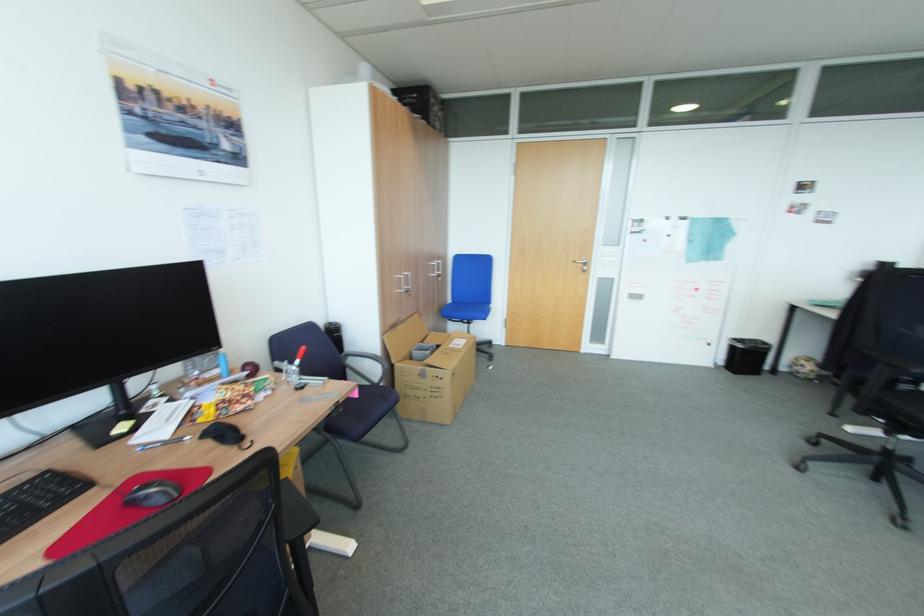
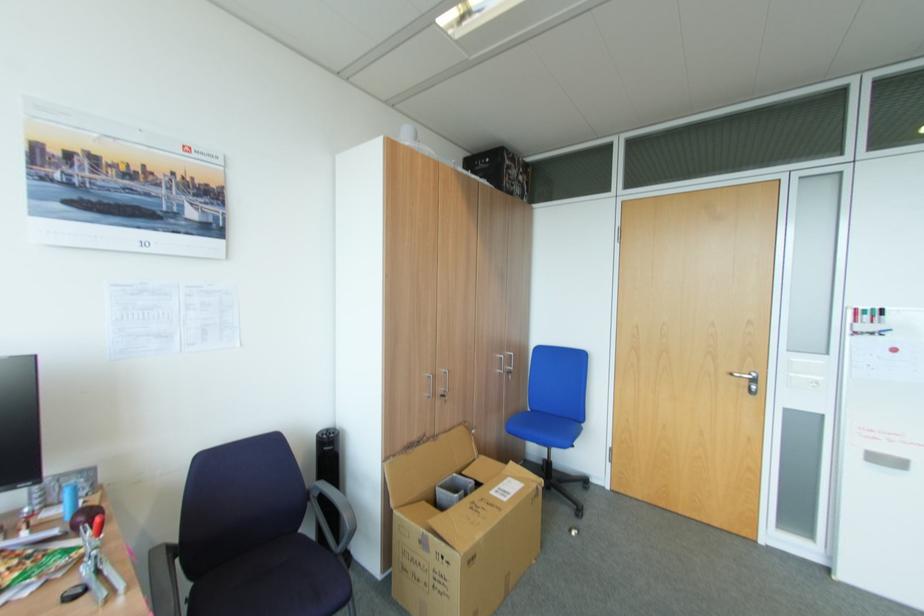
Where in the second image is the point corresponding to point 459,374 from the first image?

(479, 556)